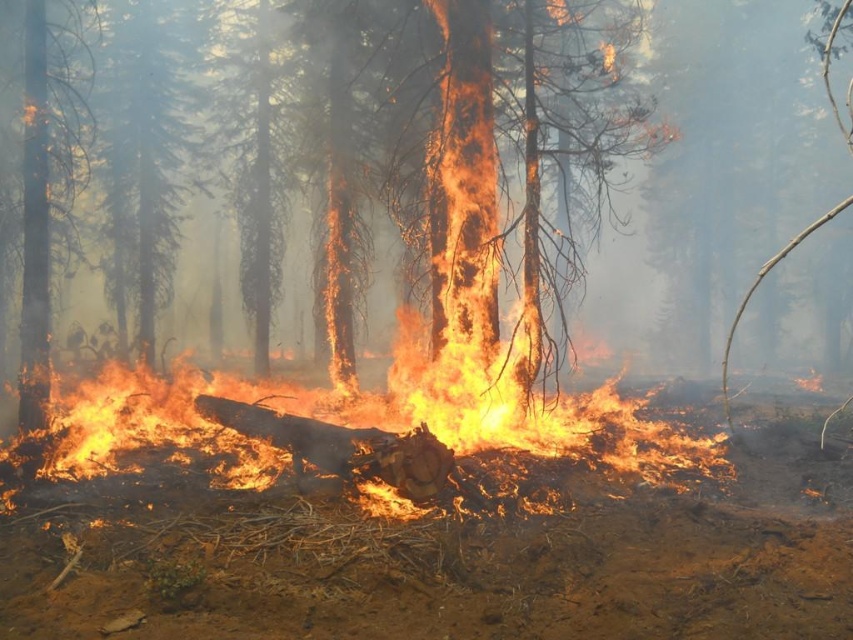
Does charred wood trunk at center appear under smooth bark tree at upper left?

Yes, charred wood trunk at center is below smooth bark tree at upper left.

Between charred wood trunk at center and smooth bark tree at upper left, which one has less height?

With less height is smooth bark tree at upper left.

Who is more distant from viewer, [456,268] or [165,0]?

The point [165,0] is more distant.

Locate an element on the screen. The height and width of the screenshot is (640, 853). charred wood trunk at center is located at coordinates (480, 209).

Between flaming wood at center and smooth bark tree at upper left, which one appears on the right side from the viewer's perspective?

From the viewer's perspective, flaming wood at center appears more on the right side.

Is point (120, 486) less distant than point (138, 188)?

Yes, point (120, 486) is closer to viewer.

Does point (451, 392) lie behind point (148, 129)?

No.

Locate an element on the screen. Image resolution: width=853 pixels, height=640 pixels. flaming wood at center is located at coordinates (346, 438).

Is flaming wood at center to the left of charred wood trunk at center from the viewer's perspective?

Indeed, flaming wood at center is positioned on the left side of charred wood trunk at center.

Can you confirm if flaming wood at center is smaller than charred wood trunk at center?

Yes.

This screenshot has height=640, width=853. What do you see at coordinates (346, 438) in the screenshot?
I see `flaming wood at center` at bounding box center [346, 438].

Find the location of a particular element. The height and width of the screenshot is (640, 853). flaming wood at center is located at coordinates (346, 438).